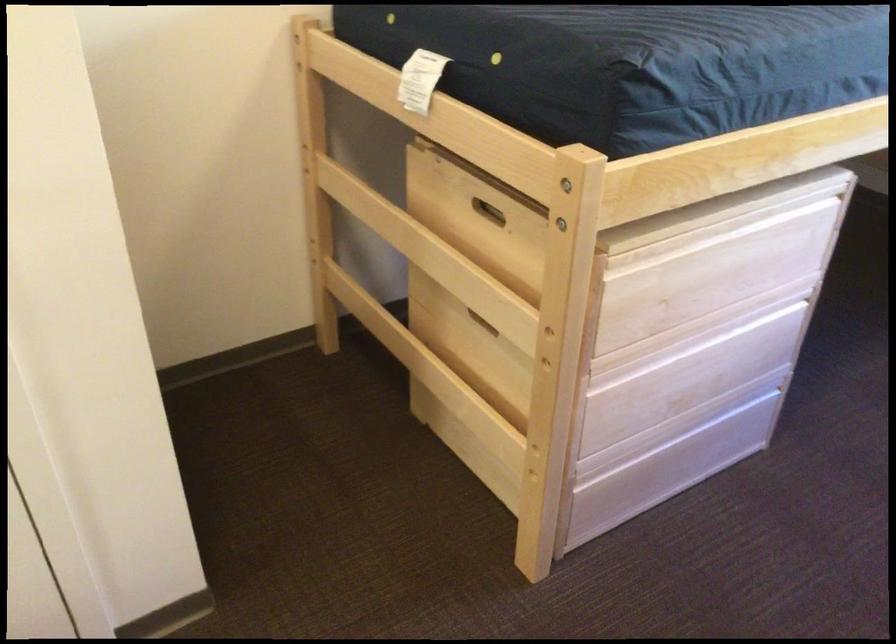
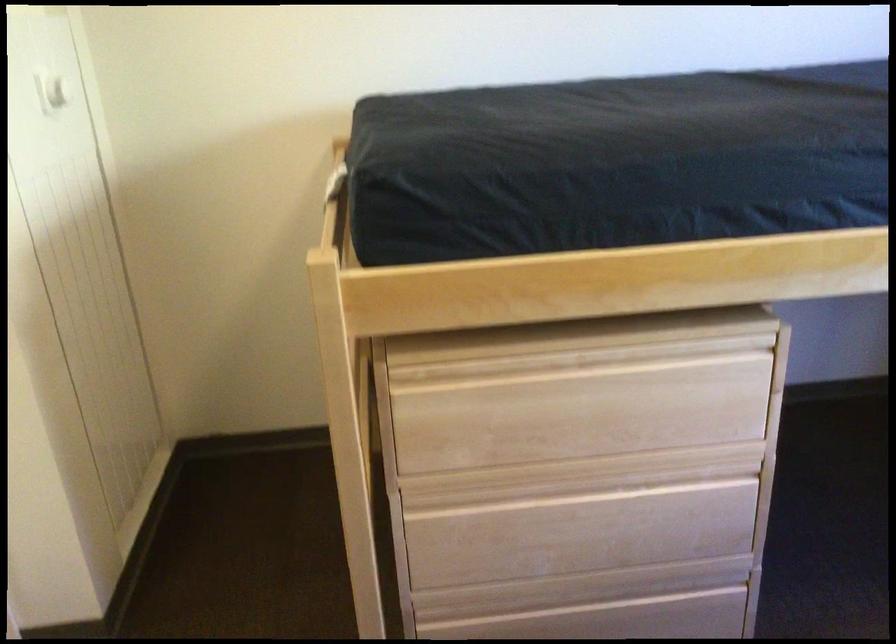
In the second image, find the point that corresponds to the point at 760,236 in the first image.

(642, 377)